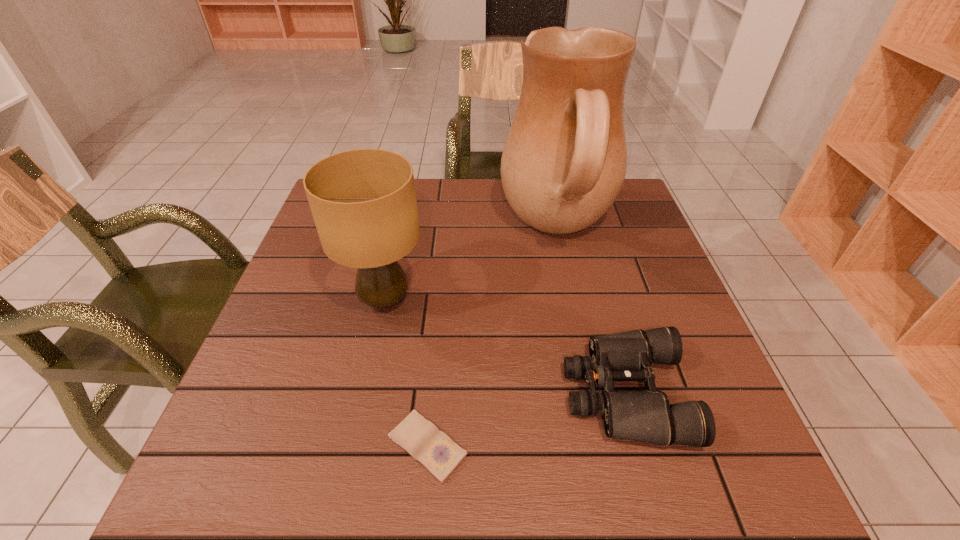
At what (x,y) coordinates should I click in order to perform the action: click on vacant space located 0.320m through the eyepieces of the second shortest object. Please return your answer as a coordinate pair (x, y). Looking at the image, I should click on (394, 394).

Where is `vacant space located 0.260m on the right of the diary`? vacant space located 0.260m on the right of the diary is located at coordinates (620, 446).

You are a GUI agent. You are given a task and a screenshot of the screen. Output one action in this format:
    pyautogui.click(x=<x>, y=<y>)
    Task: Click on the object present at the far edge
    
    Given the screenshot: What is the action you would take?
    pyautogui.click(x=564, y=162)

At what (x,y) coordinates should I click in order to perform the action: click on binoculars present at the near edge. Please return your answer as a coordinate pair (x, y). The width and height of the screenshot is (960, 540). Looking at the image, I should click on (646, 415).

Find the location of a particular element. This screenshot has width=960, height=540. diary located at the near edge is located at coordinates (433, 449).

I want to click on object at the left edge, so click(x=363, y=201).

This screenshot has height=540, width=960. What are the coordinates of `cream pitcher that is at the right edge` in the screenshot? It's located at (564, 162).

The width and height of the screenshot is (960, 540). I want to click on binoculars at the right edge, so click(x=646, y=415).

Where is `object at the far right corner`? This screenshot has height=540, width=960. object at the far right corner is located at coordinates (564, 162).

In order to click on object located at the near right corner in this screenshot , I will do `click(646, 415)`.